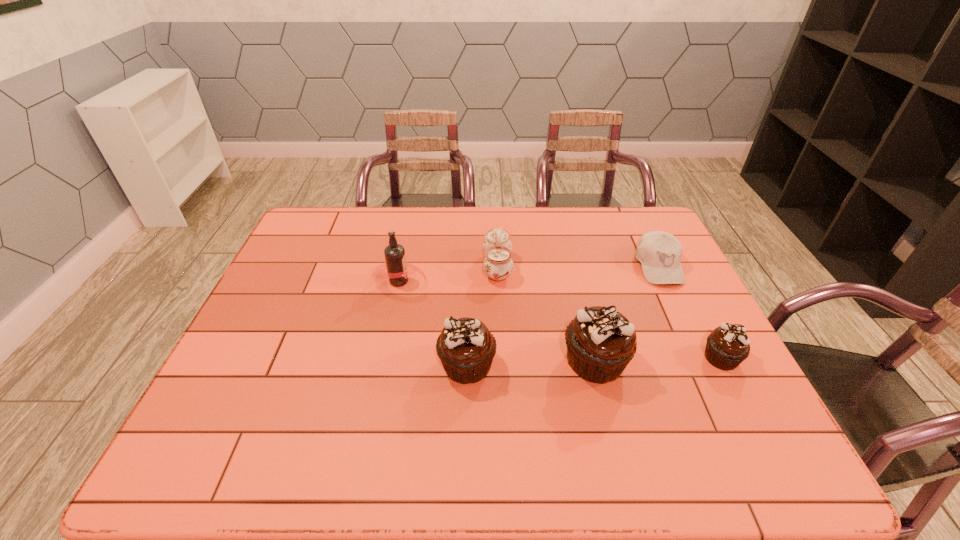
At what (x,y) coordinates should I click in order to perform the action: click on free space located 0.300m by the handle of the chinaware. Please return your answer as a coordinate pair (x, y). This screenshot has width=960, height=540. Looking at the image, I should click on (386, 267).

Identify the location of free space located by the handle of the chinaware. (454, 267).

You are a GUI agent. You are given a task and a screenshot of the screen. Output one action in this format:
    pyautogui.click(x=<x>, y=<y>)
    Task: Click on the free space located 0.170m on the front-facing side of the baseball cap
    
    Given the screenshot: What is the action you would take?
    pyautogui.click(x=690, y=332)

This screenshot has width=960, height=540. What are the coordinates of `free space located 0.380m on the label of the root beer` in the screenshot? It's located at (554, 281).

Locate an element on the screen. The width and height of the screenshot is (960, 540). cupcake situated at the right edge is located at coordinates (728, 345).

You are a GUI agent. You are given a task and a screenshot of the screen. Output one action in this format:
    pyautogui.click(x=<x>, y=<y>)
    Task: Click on the baseball cap that is at the right edge
    This screenshot has height=540, width=960.
    Given the screenshot: What is the action you would take?
    pyautogui.click(x=660, y=253)

I want to click on free space at the far edge of the desktop, so click(535, 221).

In the image, there is a desktop. At what (x,y) coordinates should I click in order to perform the action: click on blank space at the near edge. Please return your answer as a coordinate pair (x, y). This screenshot has height=540, width=960. Looking at the image, I should click on (537, 425).

Where is `vacant space at the left edge of the desktop`? The width and height of the screenshot is (960, 540). vacant space at the left edge of the desktop is located at coordinates (300, 278).

The image size is (960, 540). Identify the location of free space at the right edge of the desktop. (672, 300).